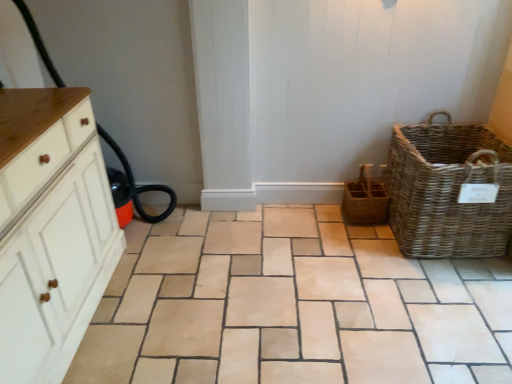
Find the location of `vacant space in front of brown woven basket at center-right`. vacant space in front of brown woven basket at center-right is located at coordinates (362, 240).